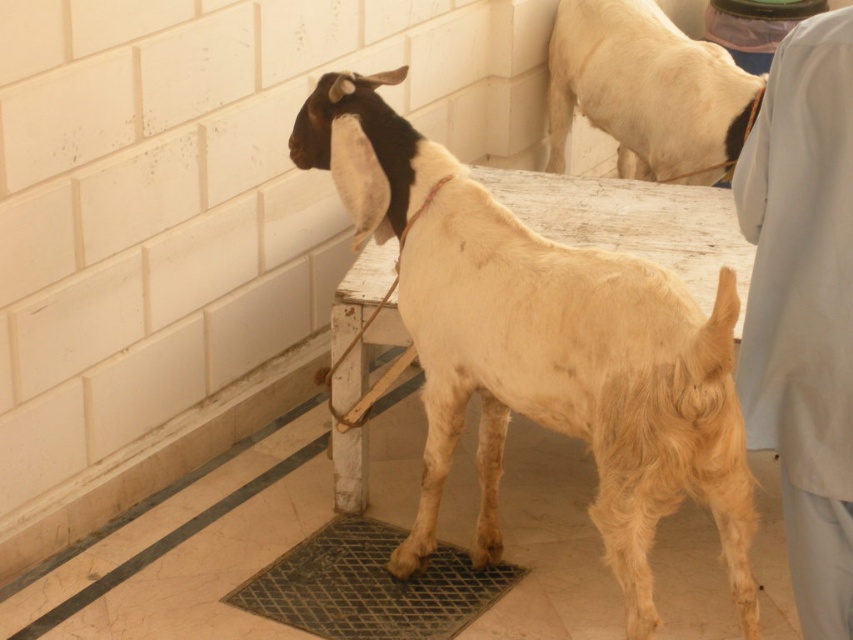
From the picture: You are standing in the stable and want to pet the light brown woolen goat at center. If your reach is 6 feet, can you touch the goat without moving?

The light brown woolen goat at center is 8.04 feet away from the viewer. Since your reach is only 6 feet, you cannot touch the goat without moving closer.

You are a farmer checking the condition of the goat in the stable. The goat has light beige fur at upper right and is near a metallic grid at lower center. Which part of the goat has less fur?

The light beige fur at upper right has less fur compared to the metallic grid at lower center, as it is described as thinner.

You are a farmer checking the space where the light brown woolen goat at center is tied. You need to ensure there is enough vertical clearance for the goat to move its head freely. Based on the scene, is the metallic grid at lower center an obstacle in this area?

The light brown woolen goat at center is taller than the metallic grid at lower center, so the grid is not an obstacle for the goat to move its head freely.